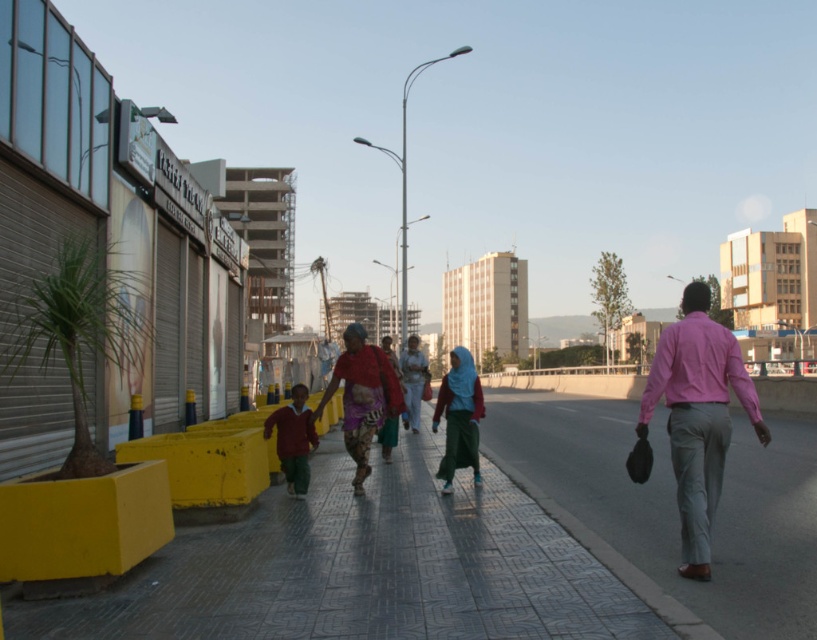
Question: Is smooth concrete pavement at center positioned in front of maroon fabric shirt at center?

Choices:
 (A) yes
 (B) no

Answer: (A)

Question: Can you confirm if gray concrete sidewalk at center is thinner than matte green skirt at center?

Choices:
 (A) no
 (B) yes

Answer: (A)

Question: Which point is closer to the camera taking this photo?

Choices:
 (A) (338, 356)
 (B) (476, 444)

Answer: (A)

Question: Which object is the closest to the multicolored fabric dress at center?

Choices:
 (A) matte green skirt at center
 (B) gray concrete sidewalk at center
 (C) maroon fabric shirt at center

Answer: (C)

Question: Which object is positioned farthest from the smooth concrete pavement at center?

Choices:
 (A) matte green skirt at center
 (B) gray concrete sidewalk at center

Answer: (B)

Question: Is matte green skirt at center below maroon fabric shirt at center?

Choices:
 (A) no
 (B) yes

Answer: (A)